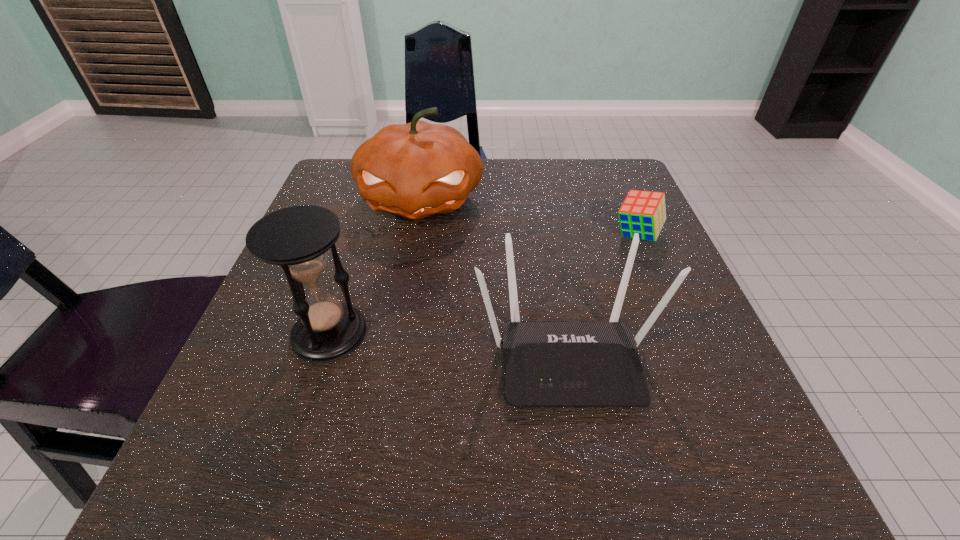
Point out which object is positioned as the nearest to the cube. Please provide its 2D coordinates. Your answer should be formatted as a tuple, i.e. [(x, y)], where the tuple contains the x and y coordinates of a point satisfying the conditions above.

[(546, 364)]